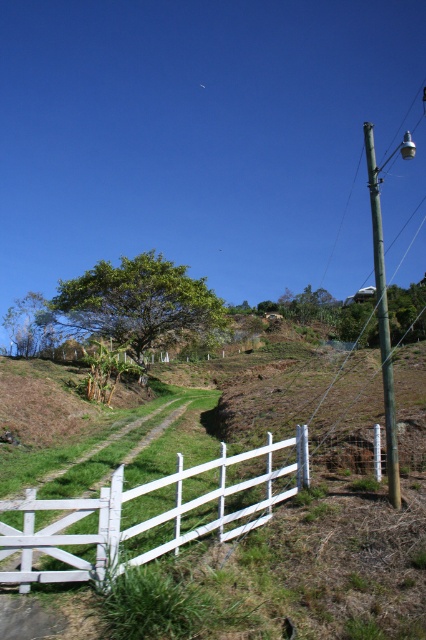
You are standing at the origin point of the image. Which direction should you move to reach the white wooden fence at lower center?

The white wooden fence at lower center is located at point coordinates of 0.812 on the x axis and 0.340 on the y axis. Since the origin is at the bottom left corner of the image, moving towards the right and slightly upward will lead you to the white wooden fence at lower center.

You are standing at the camera position looking at the rural landscape. There are two points marked in the image, one at coordinates point (118, 500) and the other at point (371, 189). Which point is physically closer to you?

Point (118, 500) is closer to the camera than point (371, 189).